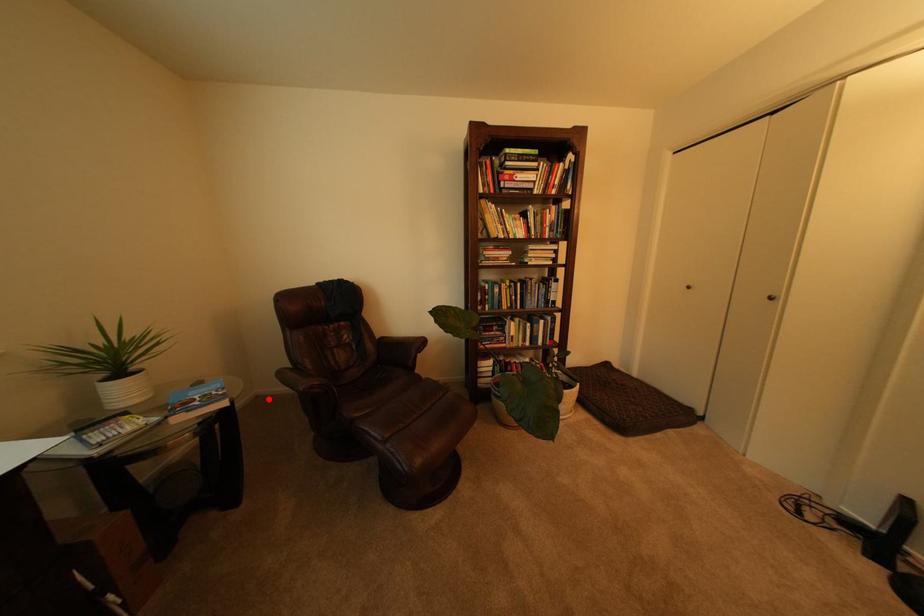
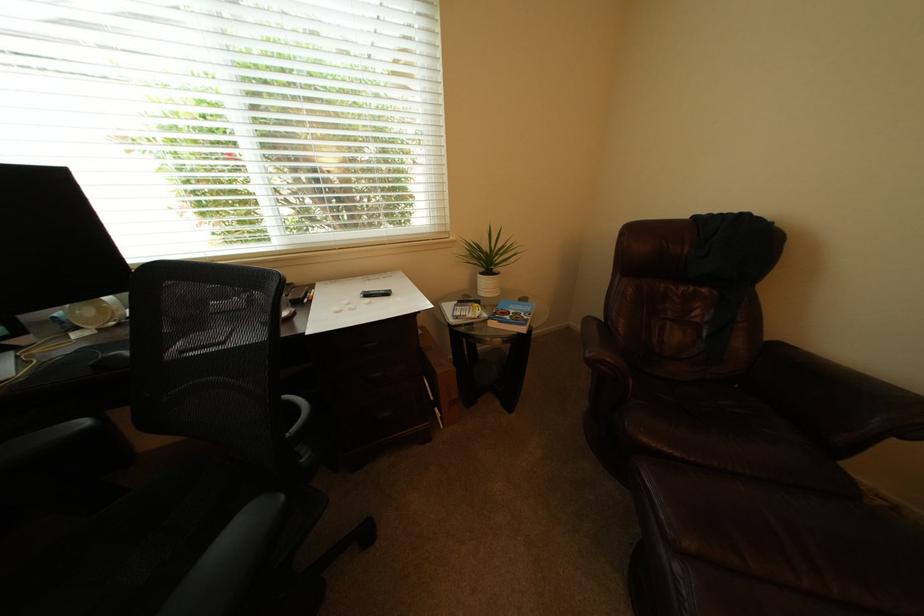
Question: I am providing you with two images of the same scene from different viewpoints. A red point is shown in image1. For the corresponding object point in image2, is it positioned nearer or farther from the camera?

Choices:
 (A) Nearer
 (B) Farther

Answer: (A)